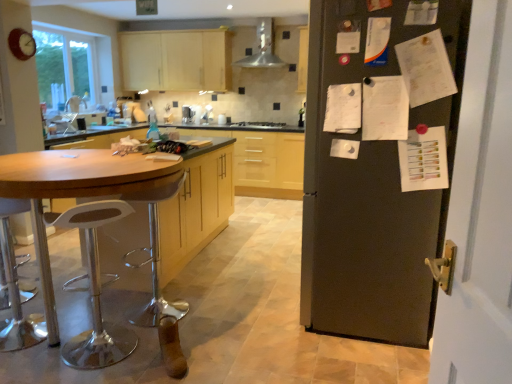
At what (x,y) coordinates should I click in order to perform the action: click on spots to the right of white plastic bar stool at left, the first bar stool in the front-to-back sequence. Please return your answer as a coordinate pair (x, y). The height and width of the screenshot is (384, 512). Looking at the image, I should click on (158, 360).